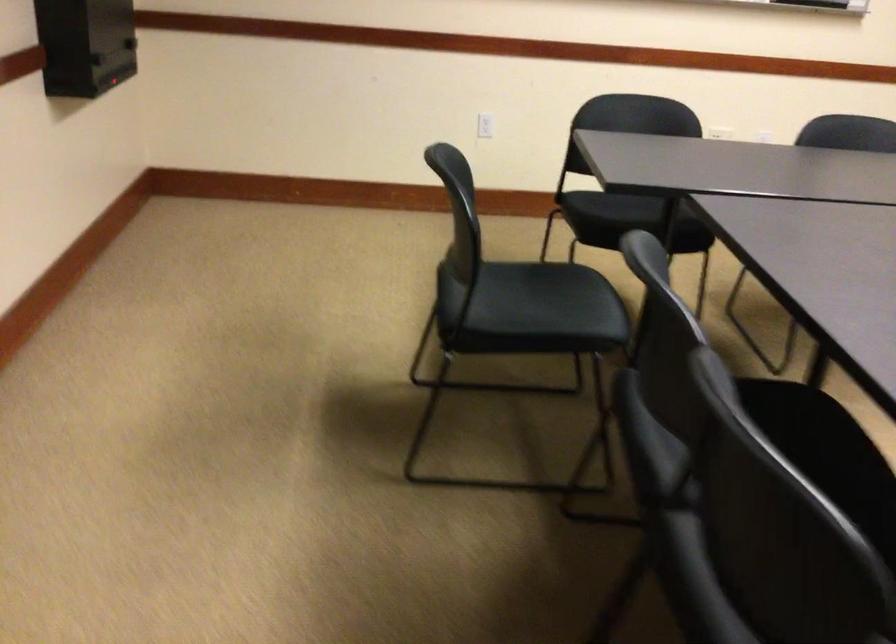
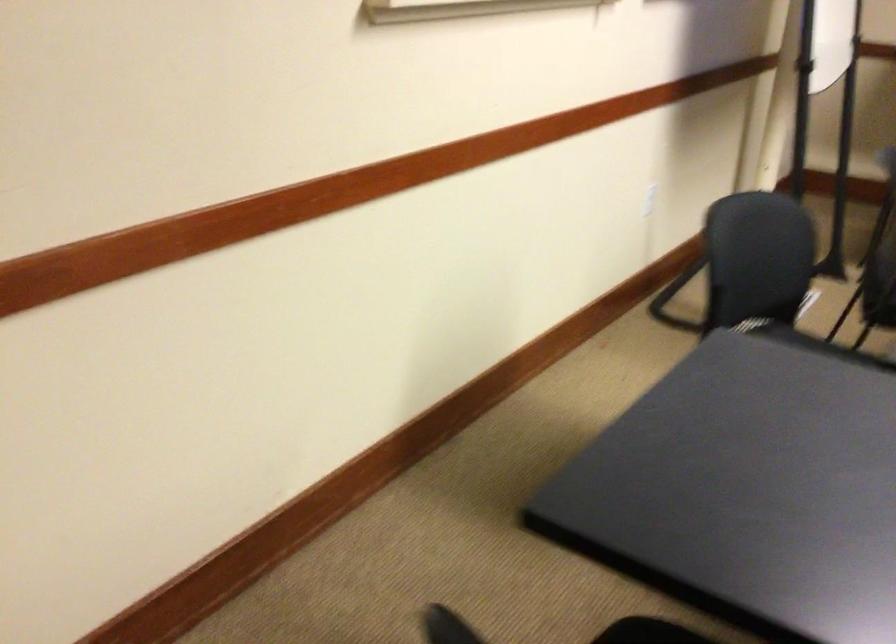
The images are taken continuously from a first-person perspective. In which direction is your viewpoint rotating?

The camera's rotation is toward right-down.